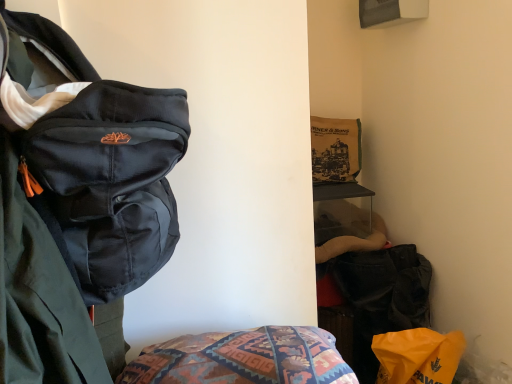
Find the location of a particular element. orange plastic bag at lower right is located at coordinates (418, 356).

Measure the distance between point (444,365) and camera.

4.37 feet.

Describe the element at coordinates (78, 204) in the screenshot. I see `matte black backpack at left` at that location.

Image resolution: width=512 pixels, height=384 pixels. Find the location of `velvet black bag at lower right`. velvet black bag at lower right is located at coordinates (382, 297).

At what (x,y) coordinates should I click in order to perform the action: click on material that is behind the matte black backpack at left. Please return your answer as a coordinate pair (x, y). Looking at the image, I should click on (418, 356).

Is matte black backpack at left with orange plastic bag at lower right?

No, matte black backpack at left is not with orange plastic bag at lower right.

What's the angular difference between matte black backpack at left and orange plastic bag at lower right's facing directions?

The facing directions of matte black backpack at left and orange plastic bag at lower right are 0.46 degrees apart.

Between matte black backpack at left and orange plastic bag at lower right, which one has smaller width?

Thinner between the two is orange plastic bag at lower right.

Is velvet black bag at lower right wider or thinner than orange plastic bag at lower right?

Considering their sizes, velvet black bag at lower right looks broader than orange plastic bag at lower right.

In terms of height, does velvet black bag at lower right look taller or shorter compared to orange plastic bag at lower right?

velvet black bag at lower right is taller than orange plastic bag at lower right.

Identify the location of luggage and bags above the orange plastic bag at lower right (from a real-world perspective). (382, 297).

From the image's perspective, is velvet black bag at lower right located above or below orange plastic bag at lower right?

velvet black bag at lower right is situated higher than orange plastic bag at lower right in the image.

Do you think matte black backpack at left is within velvet black bag at lower right, or outside of it?

The correct answer is: outside.

This screenshot has height=384, width=512. Identify the location of backpack in front of the velvet black bag at lower right. (78, 204).

Considering the relative positions of matte black backpack at left and velvet black bag at lower right in the image provided, is matte black backpack at left to the left of velvet black bag at lower right from the viewer's perspective?

Yes, matte black backpack at left is to the left of velvet black bag at lower right.

Would you say orange plastic bag at lower right is a long distance from velvet black bag at lower right?

No, orange plastic bag at lower right is not far away from velvet black bag at lower right.

Is orange plastic bag at lower right positioned beyond the bounds of velvet black bag at lower right?

orange plastic bag at lower right is positioned outside velvet black bag at lower right.

Who is shorter, orange plastic bag at lower right or velvet black bag at lower right?

Standing shorter between the two is orange plastic bag at lower right.

Could you tell me if orange plastic bag at lower right is turned towards velvet black bag at lower right?

No.

Is orange plastic bag at lower right inside the boundaries of matte black backpack at left, or outside?

The correct answer is: outside.

Is orange plastic bag at lower right at the left side of matte black backpack at left?

Incorrect, orange plastic bag at lower right is not on the left side of matte black backpack at left.

From the image's perspective, which one is positioned higher, orange plastic bag at lower right or matte black backpack at left?

matte black backpack at left.

Considering the positions of objects orange plastic bag at lower right and matte black backpack at left in the image provided, who is behind, orange plastic bag at lower right or matte black backpack at left?

orange plastic bag at lower right is further from the camera.

Looking at this image, how different are the orientations of velvet black bag at lower right and matte black backpack at left in degrees?

They differ by 0.46 degrees in their facing directions.

Considering the points (390, 290) and (22, 85), which point is behind, point (390, 290) or point (22, 85)?

The point (390, 290) is farther.

From the image's perspective, which one is positioned lower, velvet black bag at lower right or matte black backpack at left?

velvet black bag at lower right, from the image's perspective.

Is the surface of velvet black bag at lower right in direct contact with matte black backpack at left?

There is a gap between velvet black bag at lower right and matte black backpack at left.

The height and width of the screenshot is (384, 512). Find the location of `material below the matte black backpack at left (from the image's perspective)`. material below the matte black backpack at left (from the image's perspective) is located at coordinates tap(418, 356).

At what (x,y) coordinates should I click in order to perform the action: click on luggage and bags that appears above the orange plastic bag at lower right (from the image's perspective). Please return your answer as a coordinate pair (x, y). Looking at the image, I should click on (382, 297).

When comparing their distances from matte black backpack at left, does orange plastic bag at lower right or velvet black bag at lower right seem further?

Based on the image, velvet black bag at lower right appears to be further to matte black backpack at left.

Looking at the image, which one is located further to matte black backpack at left, velvet black bag at lower right or orange plastic bag at lower right?

velvet black bag at lower right is further to matte black backpack at left.

Estimate the real-world distances between objects in this image. Which object is closer to velvet black bag at lower right, orange plastic bag at lower right or matte black backpack at left?

orange plastic bag at lower right is closer to velvet black bag at lower right.

Looking at the image, which one is located closer to velvet black bag at lower right, matte black backpack at left or orange plastic bag at lower right?

Among the two, orange plastic bag at lower right is located nearer to velvet black bag at lower right.

Which object lies further to the anchor point orange plastic bag at lower right, velvet black bag at lower right or matte black backpack at left?

The object further to orange plastic bag at lower right is matte black backpack at left.

Based on the photo, looking at the image, which one is located closer to orange plastic bag at lower right, matte black backpack at left or velvet black bag at lower right?

velvet black bag at lower right.

Image resolution: width=512 pixels, height=384 pixels. I want to click on material between matte black backpack at left and velvet black bag at lower right in the front-back direction, so click(x=418, y=356).